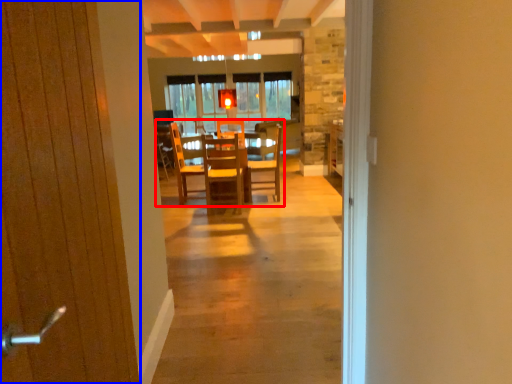
Question: Which point is further to the camera, kitchen & dining room table (highlighted by a red box) or door (highlighted by a blue box)?

Choices:
 (A) kitchen & dining room table
 (B) door

Answer: (A)